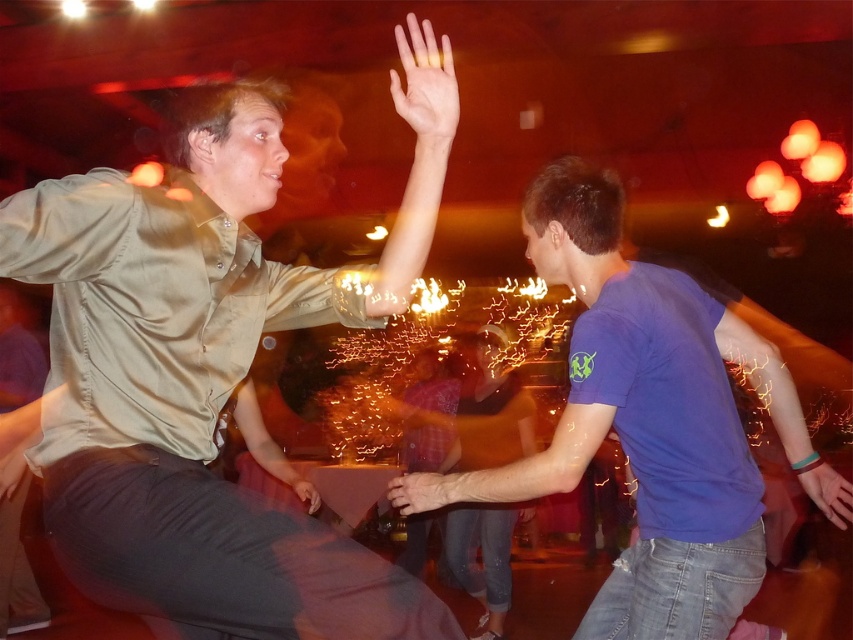
You are a photographer at the event and need to capture a photo that includes both the matte khaki shirt at upper left and the blue cotton shirt at center. Which shirt should you focus on first to ensure both are in frame?

The matte khaki shirt at upper left is taller than the blue cotton shirt at center, so focusing on the matte khaki shirt at upper left first will help ensure both are in frame.